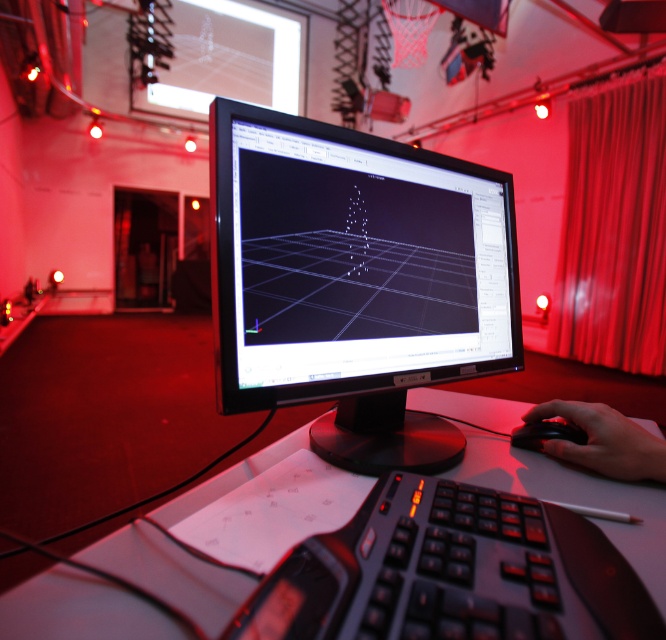
Is point (645, 291) in front of point (561, 420)?

No, it is behind (561, 420).

Consider the image. Can you confirm if silky white curtain at center is positioned above black plastic mouse at center?

Indeed, silky white curtain at center is positioned over black plastic mouse at center.

Is point (581, 157) positioned before point (527, 422)?

That is False.

Image resolution: width=666 pixels, height=640 pixels. Find the location of `silky white curtain at center`. silky white curtain at center is located at coordinates (613, 230).

Is silky white curtain at center taller than black plastic computer desk at center?

Correct, silky white curtain at center is much taller as black plastic computer desk at center.

Between silky white curtain at center and black plastic computer desk at center, which one appears on the left side from the viewer's perspective?

From the viewer's perspective, black plastic computer desk at center appears more on the left side.

This screenshot has height=640, width=666. I want to click on silky white curtain at center, so pyautogui.click(x=613, y=230).

Does point (178, 580) lie in front of point (653, 476)?

Yes, point (178, 580) is closer to viewer.

Can you confirm if black plastic computer desk at center is shorter than black matte mouse at lower right?

Yes.

This screenshot has height=640, width=666. Identify the location of black plastic computer desk at center. (79, 609).